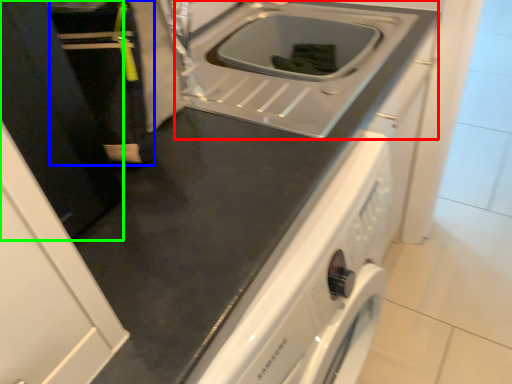
Question: Which object is the farthest from sink (highlighted by a red box)? Choose among these: person (highlighted by a blue box) or door (highlighted by a green box).

Choices:
 (A) person
 (B) door

Answer: (B)